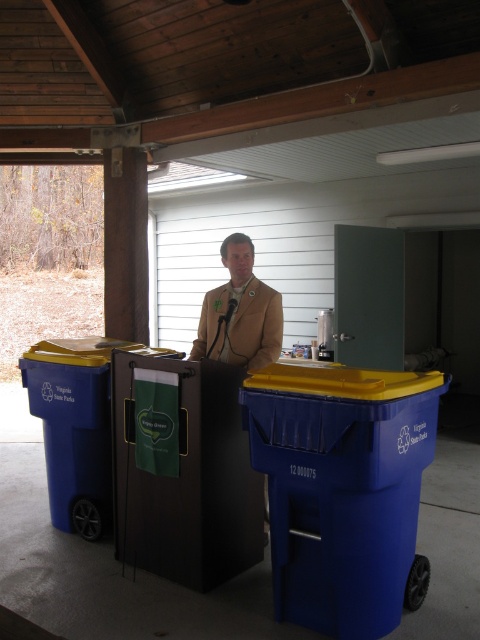
Question: Which object is farther from the camera taking this photo?

Choices:
 (A) blue plastic recycling bin at center
 (B) blue plastic recycling bin at left

Answer: (B)

Question: Estimate the real-world distances between objects in this image. Which object is farther from the blue plastic cooler at center?

Choices:
 (A) tan fabric jacket at center
 (B) blue plastic recycling bin at center
 (C) blue plastic recycling bin at left

Answer: (B)

Question: Can you confirm if blue plastic recycling bin at center is thinner than tan fabric jacket at center?

Choices:
 (A) no
 (B) yes

Answer: (A)

Question: Does blue plastic cooler at center have a lesser width compared to tan fabric jacket at center?

Choices:
 (A) yes
 (B) no

Answer: (B)

Question: Which object is the closest to the blue plastic cooler at center?

Choices:
 (A) blue plastic recycling bin at center
 (B) tan fabric jacket at center

Answer: (B)

Question: Can you confirm if blue plastic recycling bin at center is wider than blue plastic cooler at center?

Choices:
 (A) no
 (B) yes

Answer: (B)